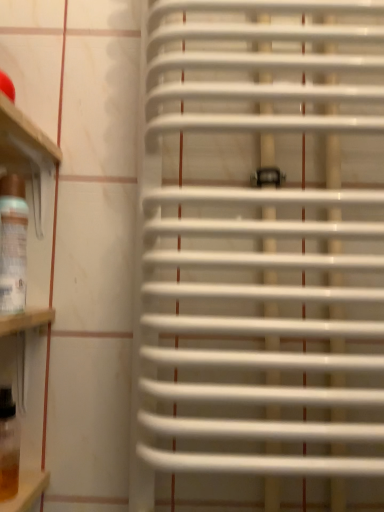
Question: Is translucent glass wine bottle at left, the first wine bottle when ordered from top to bottom, smaller than translucent amber glass at lower left, the 2th wine bottle viewed from the top?

Choices:
 (A) yes
 (B) no

Answer: (B)

Question: Does translucent glass wine bottle at left, the first wine bottle when ordered from top to bottom, have a greater width compared to translucent amber glass at lower left, the 2th wine bottle viewed from the top?

Choices:
 (A) no
 (B) yes

Answer: (A)

Question: Is translucent glass wine bottle at left, the first wine bottle when ordered from top to bottom, shorter than translucent amber glass at lower left, placed as the first wine bottle when sorted from bottom to top?

Choices:
 (A) no
 (B) yes

Answer: (A)

Question: Is there a large distance between translucent glass wine bottle at left, the first wine bottle when ordered from top to bottom, and translucent amber glass at lower left, the 2th wine bottle viewed from the top?

Choices:
 (A) no
 (B) yes

Answer: (A)

Question: Is translucent glass wine bottle at left, which is counted as the 2th wine bottle, starting from the bottom, bigger than translucent amber glass at lower left, the 2th wine bottle viewed from the top?

Choices:
 (A) yes
 (B) no

Answer: (A)

Question: In the image, is translucent amber glass at lower left, the 2th wine bottle viewed from the top, positioned in front of or behind translucent glass wine bottle at left, which is counted as the 2th wine bottle, starting from the bottom?

Choices:
 (A) behind
 (B) front

Answer: (A)

Question: Do you think translucent amber glass at lower left, placed as the first wine bottle when sorted from bottom to top, is within translucent glass wine bottle at left, which is counted as the 2th wine bottle, starting from the bottom, or outside of it?

Choices:
 (A) outside
 (B) inside

Answer: (A)

Question: From a real-world perspective, is translucent amber glass at lower left, placed as the first wine bottle when sorted from bottom to top, physically located above or below translucent glass wine bottle at left, the first wine bottle when ordered from top to bottom?

Choices:
 (A) below
 (B) above

Answer: (A)

Question: From the image's perspective, is translucent amber glass at lower left, placed as the first wine bottle when sorted from bottom to top, located above or below translucent glass wine bottle at left, the first wine bottle when ordered from top to bottom?

Choices:
 (A) above
 (B) below

Answer: (B)

Question: Is point (302, 98) closer or farther from the camera than point (16, 490)?

Choices:
 (A) closer
 (B) farther

Answer: (B)

Question: Is white plastic radiator at center wider or thinner than translucent amber glass at lower left, placed as the first wine bottle when sorted from bottom to top?

Choices:
 (A) wide
 (B) thin

Answer: (A)

Question: Would you say white plastic radiator at center is inside or outside translucent amber glass at lower left, the 2th wine bottle viewed from the top?

Choices:
 (A) outside
 (B) inside

Answer: (A)

Question: Would you say white plastic radiator at center is to the left or to the right of translucent amber glass at lower left, placed as the first wine bottle when sorted from bottom to top, in the picture?

Choices:
 (A) right
 (B) left

Answer: (A)

Question: Is translucent glass wine bottle at left, which is counted as the 2th wine bottle, starting from the bottom, inside or outside of white plastic radiator at center?

Choices:
 (A) outside
 (B) inside

Answer: (A)

Question: From the image's perspective, relative to white plastic radiator at center, is translucent glass wine bottle at left, the first wine bottle when ordered from top to bottom, above or below?

Choices:
 (A) below
 (B) above

Answer: (B)